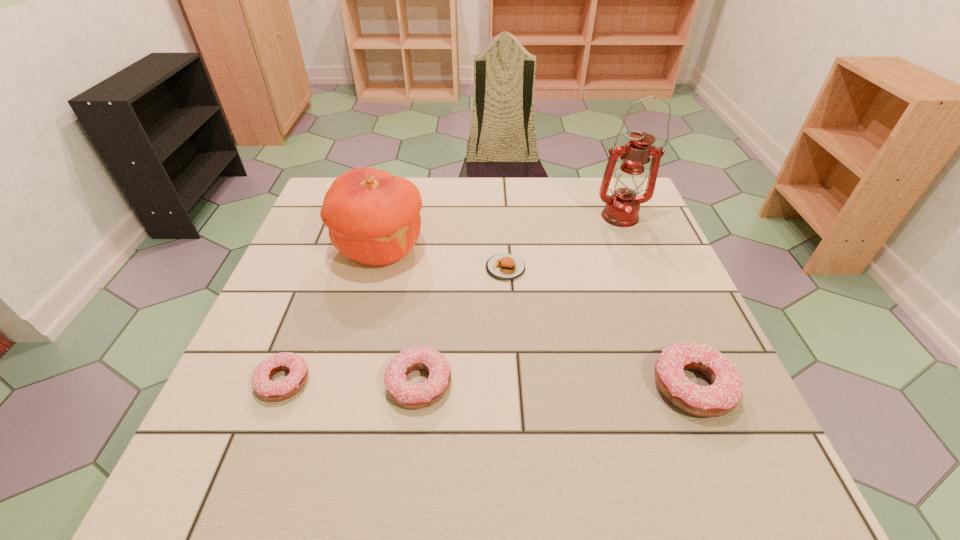
This screenshot has height=540, width=960. I want to click on object at the far left corner, so click(373, 217).

At what (x,y) coordinates should I click in order to perform the action: click on object situated at the near left corner. Please return your answer as a coordinate pair (x, y). The width and height of the screenshot is (960, 540). Looking at the image, I should click on (264, 388).

Locate an element on the screen. object located in the far right corner section of the desktop is located at coordinates (622, 208).

Where is `object located in the near right corner section of the desktop`? The image size is (960, 540). object located in the near right corner section of the desktop is located at coordinates (722, 396).

This screenshot has width=960, height=540. In order to click on vacant area at the far edge of the desktop in this screenshot , I will do `click(464, 217)`.

This screenshot has width=960, height=540. In the image, there is a desktop. Identify the location of vacant space at the near edge. (415, 418).

The width and height of the screenshot is (960, 540). I want to click on vacant point at the left edge, so click(330, 275).

Where is `free region at the right edge of the desktop`? free region at the right edge of the desktop is located at coordinates (610, 249).

The height and width of the screenshot is (540, 960). I want to click on free space at the far right corner of the desktop, so click(x=653, y=219).

This screenshot has height=540, width=960. In order to click on blank region between the shortest doughnut and the food in this screenshot , I will do `click(395, 325)`.